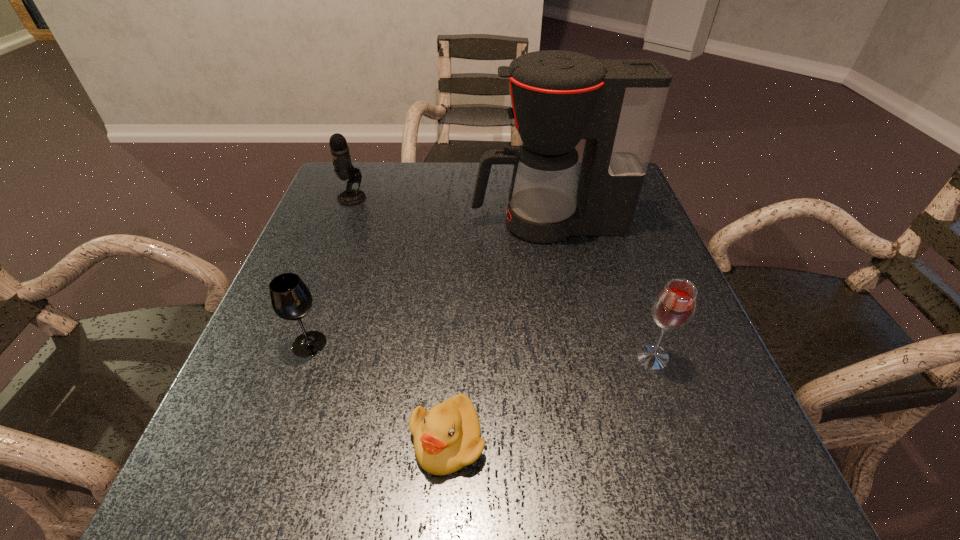
Identify the location of coffee maker. (558, 97).

What are the coordinates of `microphone` in the screenshot? It's located at (344, 169).

The width and height of the screenshot is (960, 540). Find the location of `the right wineglass`. the right wineglass is located at coordinates (673, 308).

I want to click on the left wineglass, so click(290, 298).

The height and width of the screenshot is (540, 960). What are the coordinates of `the nearest object` in the screenshot? It's located at (447, 438).

Where is `duckling`? duckling is located at coordinates (447, 438).

At what (x,y) coordinates should I click in order to perform the action: click on vacant space located 0.240m pour from the carafe of the tallest object. Please return your answer as a coordinate pair (x, y). The image size is (960, 540). Looking at the image, I should click on (374, 224).

Locate an element on the screen. vacant region located 0.050m pour from the carafe of the tallest object is located at coordinates (451, 224).

Identify the location of vacant region located pour from the carafe of the tallest object. (322, 224).

At what (x,y) coordinates should I click in order to perform the action: click on vacant space located 0.110m on the back of the microphone. Please return your answer as a coordinate pair (x, y). The width and height of the screenshot is (960, 540). Looking at the image, I should click on click(x=363, y=170).